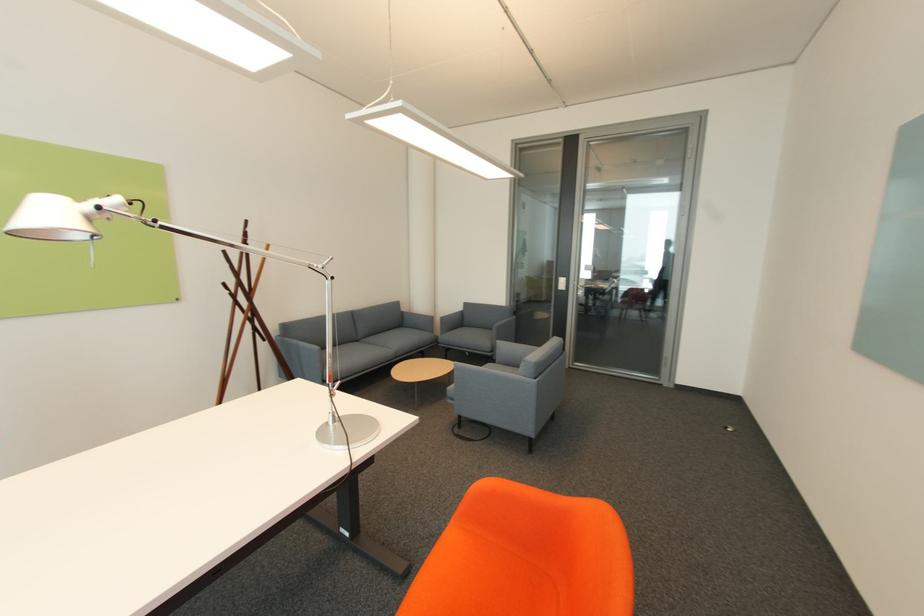
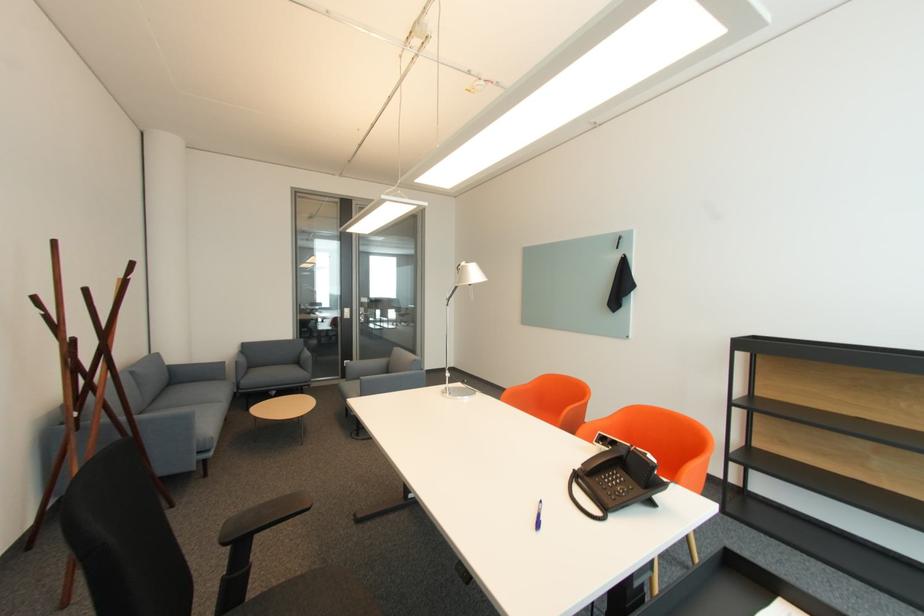
Locate, in the second image, the point that corresponds to [365,341] in the first image.

(151, 411)